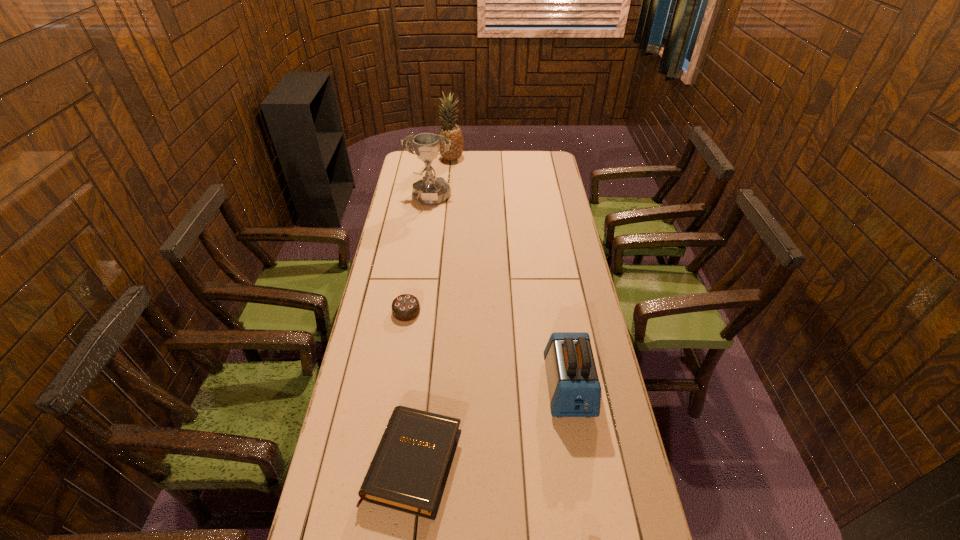
The height and width of the screenshot is (540, 960). I want to click on pineapple, so click(451, 131).

Where is `the fourth nearest object`? the fourth nearest object is located at coordinates (429, 191).

Where is `the third tallest object`? The width and height of the screenshot is (960, 540). the third tallest object is located at coordinates (574, 389).

Where is `the rightmost object`? Image resolution: width=960 pixels, height=540 pixels. the rightmost object is located at coordinates (574, 389).

This screenshot has width=960, height=540. In order to click on chocolate cake in this screenshot , I will do `click(406, 307)`.

Find the location of `the shortest object`. the shortest object is located at coordinates (409, 471).

This screenshot has width=960, height=540. Find the location of `vacant space located on the front of the farthest object`. vacant space located on the front of the farthest object is located at coordinates (449, 183).

The height and width of the screenshot is (540, 960). What are the coordinates of `free location located 0.400m on the side with emblem of the fourth nearest object` in the screenshot? It's located at (420, 277).

Identify the location of vacant space located on the front-facing side of the toaster. The image size is (960, 540). (579, 446).

In order to click on vacant space situated on the back of the third farthest object in this screenshot , I will do `click(414, 265)`.